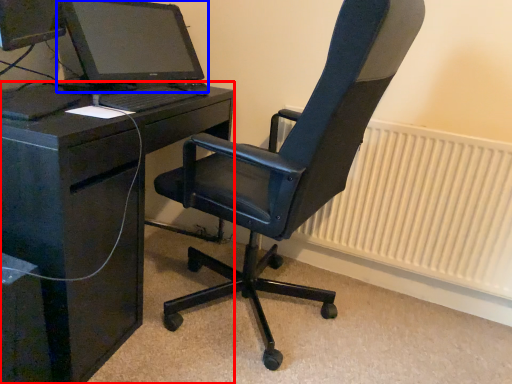
Question: Which object is further to the camera taking this photo, desk (highlighted by a red box) or computer monitor (highlighted by a blue box)?

Choices:
 (A) desk
 (B) computer monitor

Answer: (B)